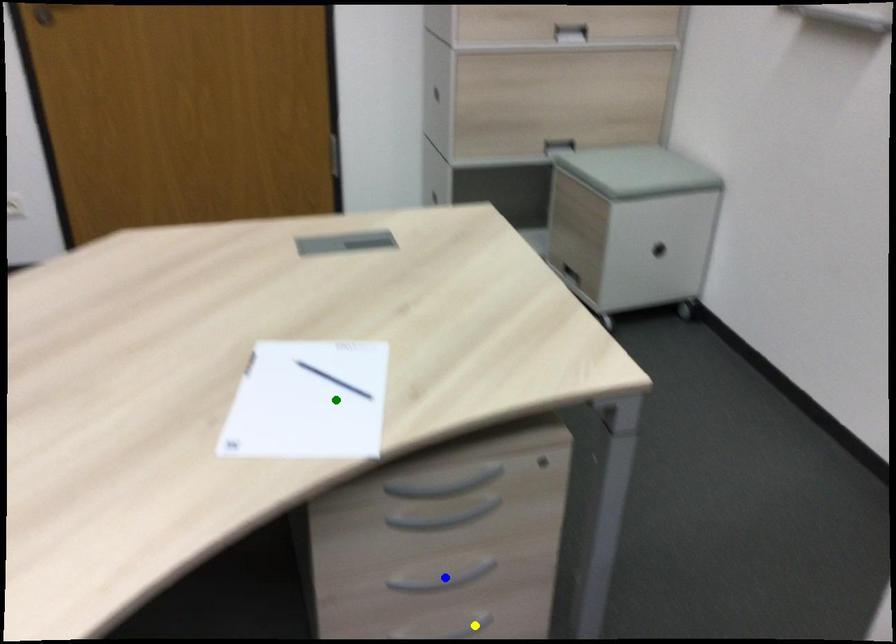
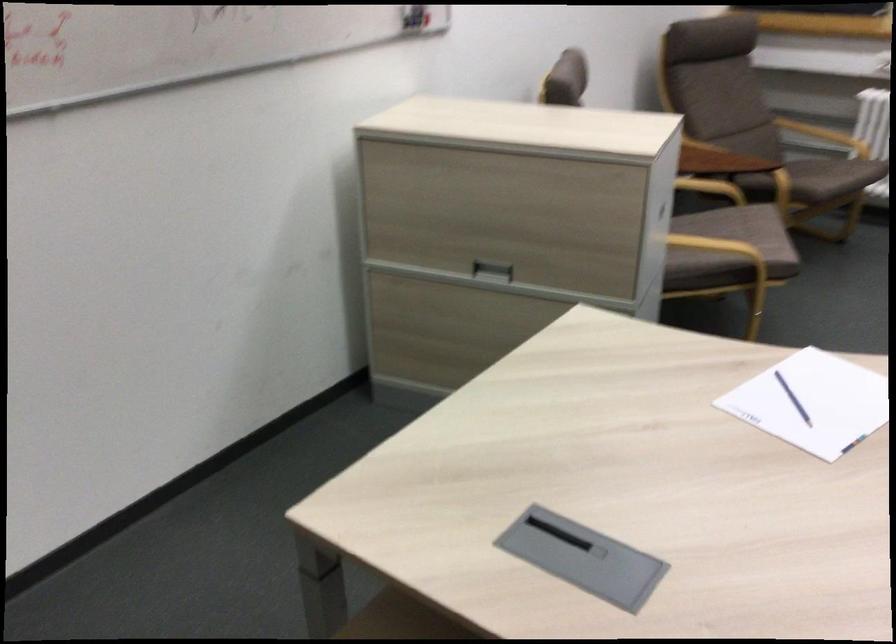
I am providing you with two images of the same scene from different viewpoints. Three points are marked in image1. Which point corresponds to a part or object that is occluded in image2?In image1, three points are marked. Which of them correspond to a part or object that is occluded in image2?Among the three points shown in image1, which one corresponds to a part or object that is no longer visible due to occlusion in image2?

yellow point, blue point